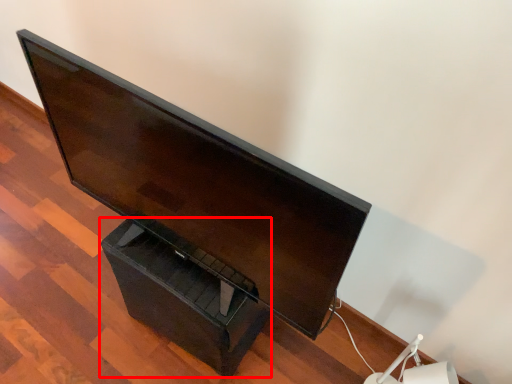
Question: In this image, where is drawer (annotated by the red box) located relative to computer monitor?

Choices:
 (A) right
 (B) left

Answer: (B)